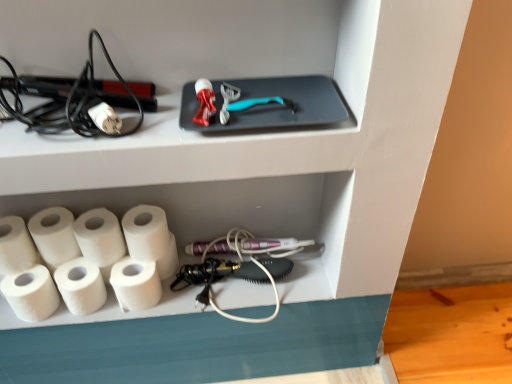
Question: Is white matte paper towel at lower left, arranged as the fourth paper towel when viewed from the left, bigger than white matte paper towel at lower left, placed as the 2th paper towel when sorted from right to left?

Choices:
 (A) yes
 (B) no

Answer: (B)

Question: Can you confirm if white matte paper towel at lower left, marked as the fourth paper towel in a right-to-left arrangement, is thinner than white matte paper towel at lower left, placed as the 2th paper towel when sorted from right to left?

Choices:
 (A) no
 (B) yes

Answer: (B)

Question: Can you confirm if white matte paper towel at lower left, arranged as the fourth paper towel when viewed from the left, is taller than white matte paper towel at lower left, placed as the 2th paper towel when sorted from right to left?

Choices:
 (A) no
 (B) yes

Answer: (A)

Question: Is white matte paper towel at lower left, marked as the fourth paper towel in a right-to-left arrangement, aimed at white matte paper towel at lower left, placed as the sixth paper towel when sorted from left to right?

Choices:
 (A) yes
 (B) no

Answer: (B)

Question: Is white matte paper towel at lower left, marked as the fourth paper towel in a right-to-left arrangement, at the left side of white matte paper towel at lower left, placed as the 2th paper towel when sorted from right to left?

Choices:
 (A) yes
 (B) no

Answer: (A)

Question: From the image's perspective, would you say white matte paper towel at lower left, arranged as the fourth paper towel when viewed from the left, is positioned over white matte paper towel at lower left, placed as the 2th paper towel when sorted from right to left?

Choices:
 (A) no
 (B) yes

Answer: (A)

Question: Can you confirm if white matte paper towel at lower left, arranged as the fourth paper towel when viewed from the left, is thinner than white matte paper towel at lower left, positioned as the first paper towel in left-to-right order?

Choices:
 (A) no
 (B) yes

Answer: (B)

Question: Can you confirm if white matte paper towel at lower left, marked as the fourth paper towel in a right-to-left arrangement, is taller than white matte paper towel at lower left, the 7th paper towel from the right?

Choices:
 (A) yes
 (B) no

Answer: (B)

Question: Is white matte paper towel at lower left, arranged as the fourth paper towel when viewed from the left, oriented towards white matte paper towel at lower left, positioned as the first paper towel in left-to-right order?

Choices:
 (A) no
 (B) yes

Answer: (A)

Question: From a real-world perspective, is white matte paper towel at lower left, arranged as the fourth paper towel when viewed from the left, on white matte paper towel at lower left, the 7th paper towel from the right?

Choices:
 (A) yes
 (B) no

Answer: (B)

Question: Is white matte paper towel at lower left, marked as the fourth paper towel in a right-to-left arrangement, to the left of white matte paper towel at lower left, the 7th paper towel from the right, from the viewer's perspective?

Choices:
 (A) yes
 (B) no

Answer: (B)

Question: Is white matte paper towel at lower left, marked as the fourth paper towel in a right-to-left arrangement, wider than white matte paper towel at lower left, positioned as the first paper towel in left-to-right order?

Choices:
 (A) no
 (B) yes

Answer: (A)

Question: Considering the relative sizes of black plastic hair straightener at left and white matte paper towel at lower left, which ranks as the fifth paper towel in right-to-left order, in the image provided, is black plastic hair straightener at left smaller than white matte paper towel at lower left, which ranks as the fifth paper towel in right-to-left order,?

Choices:
 (A) no
 (B) yes

Answer: (A)